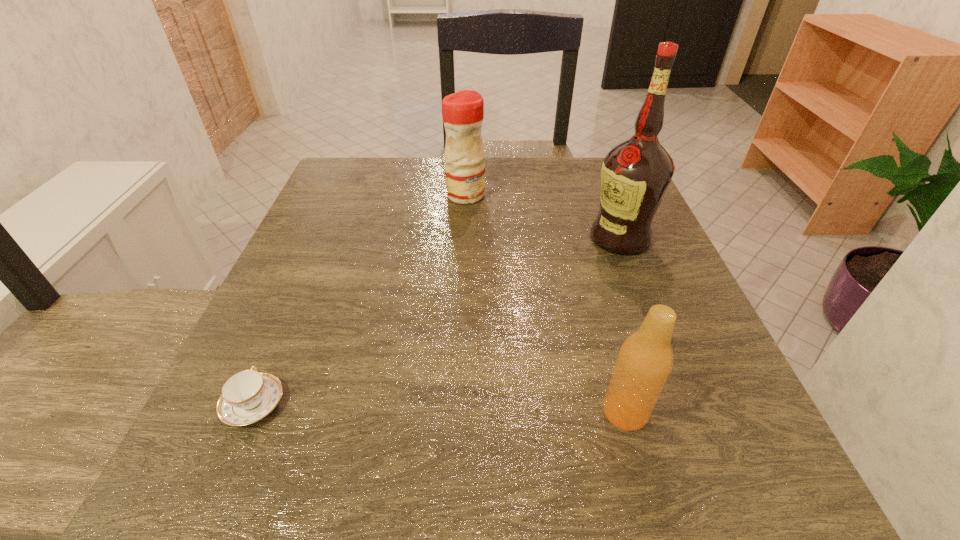
Where is `unoccupied area between the third shortest object and the third tallest object`? The height and width of the screenshot is (540, 960). unoccupied area between the third shortest object and the third tallest object is located at coordinates (545, 303).

Where is `vacant space in between the tallest object and the third object from right to left`? This screenshot has width=960, height=540. vacant space in between the tallest object and the third object from right to left is located at coordinates (542, 217).

I want to click on vacant space that is in between the third shortest object and the second shortest object, so click(545, 303).

Identify the location of unoccupied area between the tallest object and the beer bottle. The image size is (960, 540). (622, 325).

Find the location of a particular element. The image size is (960, 540). vacant point located between the third tallest object and the shortest object is located at coordinates (440, 408).

The image size is (960, 540). I want to click on free spot between the third object from right to left and the tallest object, so click(x=542, y=217).

This screenshot has height=540, width=960. In order to click on the third closest object to the beer bottle in this screenshot , I will do `click(462, 112)`.

Identify the location of object identified as the third closest to the alcohol. (248, 396).

The width and height of the screenshot is (960, 540). Find the location of `free spot that satisfies the following two spatial constraints: 1. on the side with the handle of the leftmost object; 2. on the right side of the third object from right to left`. free spot that satisfies the following two spatial constraints: 1. on the side with the handle of the leftmost object; 2. on the right side of the third object from right to left is located at coordinates coord(344,195).

I want to click on vacant region that satisfies the following two spatial constraints: 1. on the side with the handle of the second object from left to right; 2. on the left side of the shortest object, so click(x=344, y=195).